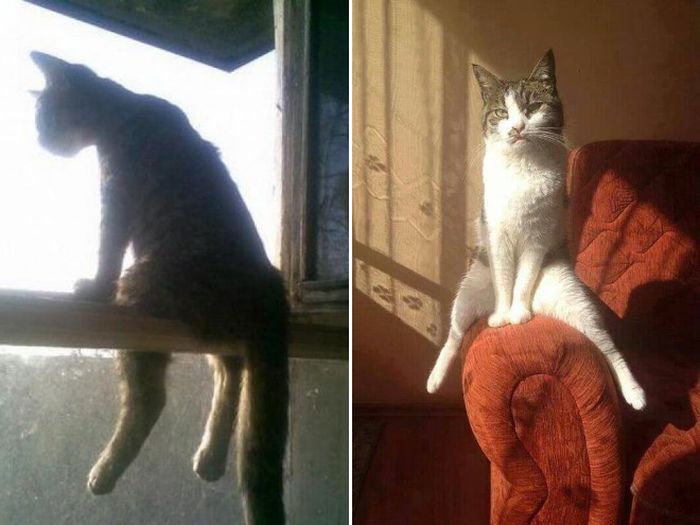
The width and height of the screenshot is (700, 525). Identify the location of tan wall. (420, 38), (400, 171).